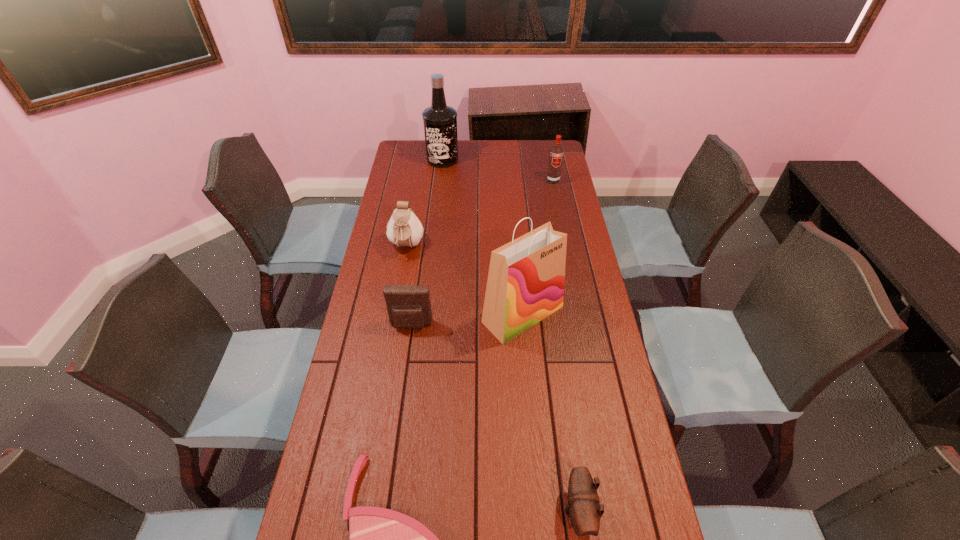
Where is `vacant space positioned with an open flap on the second farthest pouch`? vacant space positioned with an open flap on the second farthest pouch is located at coordinates (406, 364).

Locate an element on the screen. The width and height of the screenshot is (960, 540). object that is at the far edge is located at coordinates (440, 121).

Where is `liquor that is at the left edge`? liquor that is at the left edge is located at coordinates (440, 121).

At what (x,y) coordinates should I click in order to perform the action: click on shopping bag present at the right edge. Please return your answer as a coordinate pair (x, y). Looking at the image, I should click on tap(525, 284).

The width and height of the screenshot is (960, 540). In order to click on vodka that is positioned at the right edge in this screenshot , I will do `click(556, 152)`.

Identify the location of object located at the far left corner. (440, 121).

Identify the location of vacant space at the far edge. (487, 160).

Where is `vacant space at the left edge`? The image size is (960, 540). vacant space at the left edge is located at coordinates (373, 251).

Locate an element on the screen. The image size is (960, 540). free space at the right edge of the desktop is located at coordinates [564, 206].

Locate an element on the screen. Image resolution: width=960 pixels, height=540 pixels. free space at the far left corner is located at coordinates (404, 145).